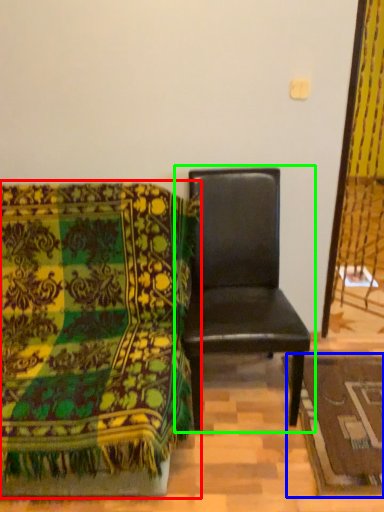
Question: Which object is the closest to the chair (highlighted by a red box)? Choose among these: mat (highlighted by a blue box) or chair (highlighted by a green box).

Choices:
 (A) mat
 (B) chair

Answer: (B)